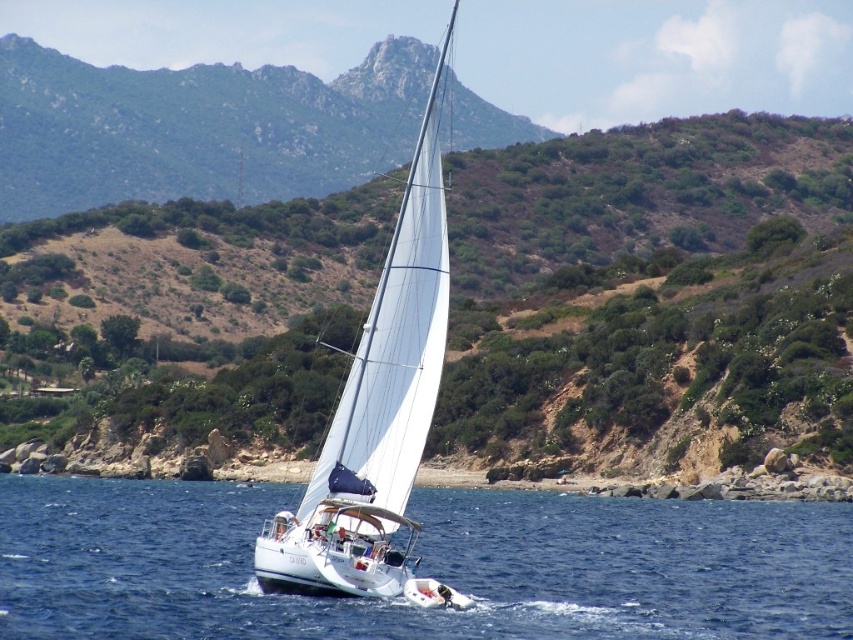
You are a photographer planning to capture the white sailboat at center and the blue water at center in a single frame. Which of these two elements takes up more space in the image?

The white sailboat at center occupies more space than the blue water at center according to the description provided.

You are a photographer planning to capture the green shrubbery at center and the white sailboat at center in a single frame. Given that your camera has a fixed focal length, which object should you focus on to ensure both are in the frame without cropping?

The green shrubbery at center is bigger than the white sailboat at center, so you should focus on the white sailboat at center to ensure both are in the frame without cropping.

You are standing on the deck of the sailboat and want to determine which of the two points, point (140, 504) or point (409, 458), is closer to you. Based on the coordinates provided, which point is nearer to your current position?

Point (140, 504) is closer to you because it is further to the viewer than point (409, 458).